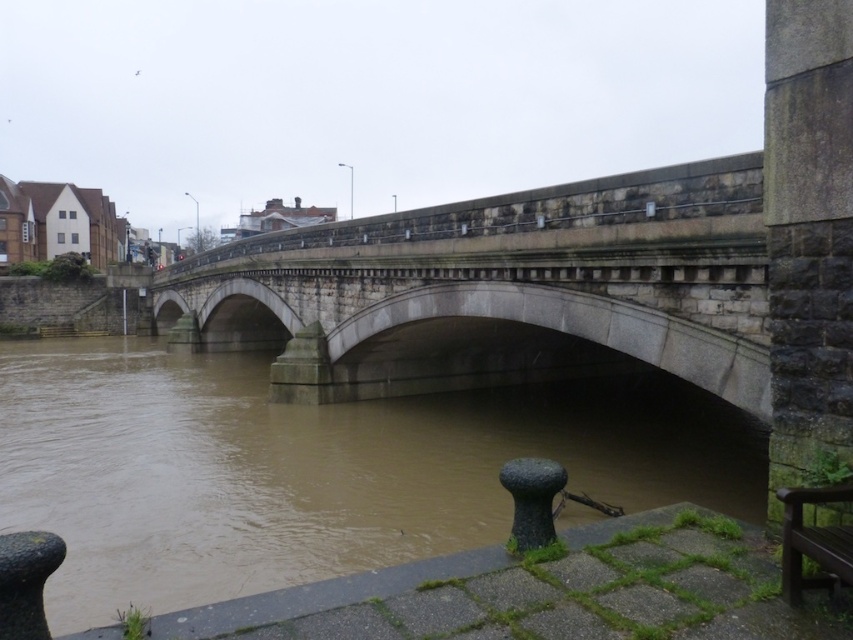
You are a hiker who wants to cross the stone bridge but needs to rest first. There is a wooden park bench at lower right and brown muddy water at center. Which object is closer to your current position if you are standing on the bridge?

The wooden park bench at lower right is closer to your current position because the brown muddy water at center is 13.03 meters away from it.

Based on the photo, you are standing on the stone bridge and want to cross to the other side. There is a point marked at coordinates (312, 468). What is located at that point?

The point at coordinates (312, 468) has brown muddy water at center.